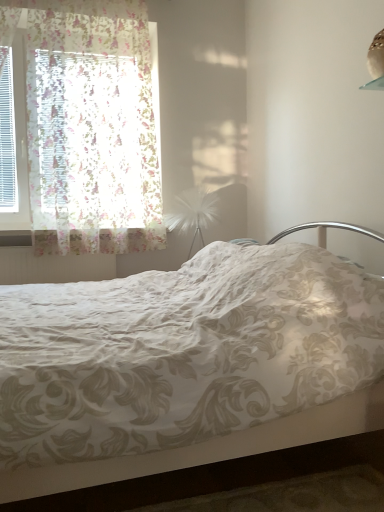
Question: Are floral lace curtain at left and white feather at center far apart?

Choices:
 (A) no
 (B) yes

Answer: (A)

Question: From the image's perspective, is floral lace curtain at left on white feather at center?

Choices:
 (A) no
 (B) yes

Answer: (B)

Question: Could you tell me if floral lace curtain at left is facing white feather at center?

Choices:
 (A) yes
 (B) no

Answer: (B)

Question: Is floral lace curtain at left outside white feather at center?

Choices:
 (A) no
 (B) yes

Answer: (B)

Question: Is floral lace curtain at left wider than white feather at center?

Choices:
 (A) no
 (B) yes

Answer: (A)

Question: Can you confirm if floral lace curtain at left is thinner than white feather at center?

Choices:
 (A) no
 (B) yes

Answer: (B)

Question: Does white floral fabric bed at center have a lesser height compared to white feather at center?

Choices:
 (A) yes
 (B) no

Answer: (B)

Question: Is white floral fabric bed at center looking in the opposite direction of white feather at center?

Choices:
 (A) yes
 (B) no

Answer: (B)

Question: Does white floral fabric bed at center have a lesser width compared to white feather at center?

Choices:
 (A) no
 (B) yes

Answer: (A)

Question: Is white floral fabric bed at center wider than white feather at center?

Choices:
 (A) no
 (B) yes

Answer: (B)

Question: Is white floral fabric bed at center next to white feather at center and touching it?

Choices:
 (A) yes
 (B) no

Answer: (B)

Question: Is white floral fabric bed at center facing towards white feather at center?

Choices:
 (A) yes
 (B) no

Answer: (B)

Question: Can you confirm if floral lace curtain at left is positioned to the left of white floral fabric bed at center?

Choices:
 (A) no
 (B) yes

Answer: (B)